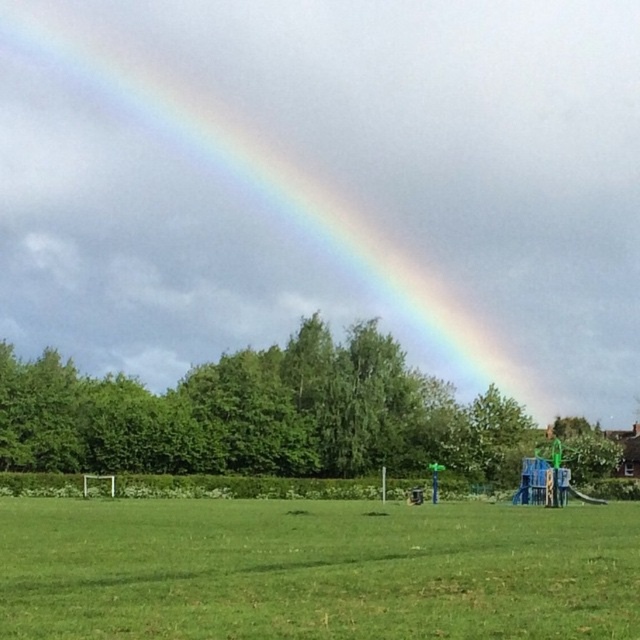
Is point (372, 250) less distant than point (346, 545)?

No.

Looking at this image, who is more distant from viewer, (406,112) or (332,524)?

The point (406,112) is more distant.

Between point (140, 262) and point (131, 624), which one is positioned in front?

Point (131, 624) is more forward.

Where is `rainbow at upper center`? This screenshot has height=640, width=640. rainbow at upper center is located at coordinates (257, 179).